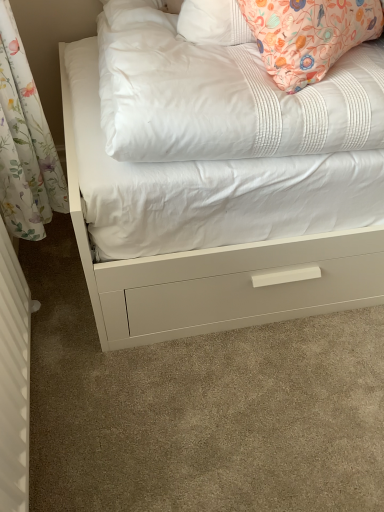
This screenshot has width=384, height=512. I want to click on vacant space in white textured radiator at left (from a real-world perspective), so click(37, 408).